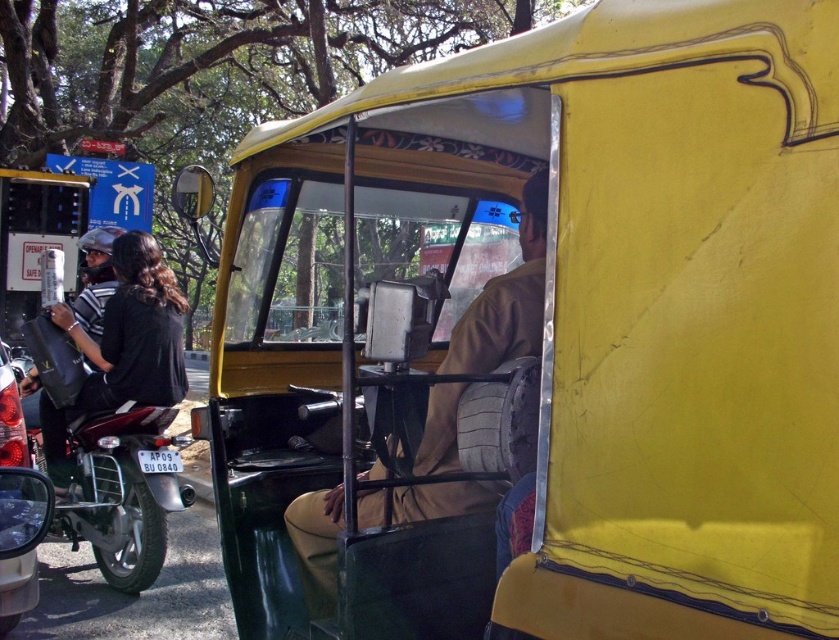
Between point (440, 493) and point (141, 236), which one is positioned in front?

Point (440, 493)

Is point (319, 557) farther from camera compared to point (160, 284)?

No, it is in front of (160, 284).

Where is `light brown fabric seat at center`? The image size is (839, 640). light brown fabric seat at center is located at coordinates (506, 298).

Can you confirm if black leather jacket at left is bigger than shiny black motorcycle at left?

No.

Measure the distance between black leather jacket at left and shiny black motorcycle at left.

A distance of 16.06 inches exists between black leather jacket at left and shiny black motorcycle at left.

Where is `black leather jacket at left`? This screenshot has height=640, width=839. black leather jacket at left is located at coordinates (118, 340).

Does light brown fabric seat at center appear on the right side of shiny black motorcycle at left?

Indeed, light brown fabric seat at center is positioned on the right side of shiny black motorcycle at left.

Is light brown fabric seat at center shorter than shiny black motorcycle at left?

In fact, light brown fabric seat at center may be taller than shiny black motorcycle at left.

Is point (477, 484) closer to viewer compared to point (108, 580)?

That is True.

Image resolution: width=839 pixels, height=640 pixels. Find the location of `light brown fabric seat at center`. light brown fabric seat at center is located at coordinates click(506, 298).